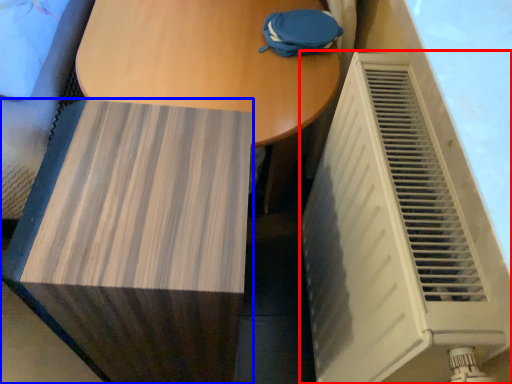
Question: Which object is further to the camera taking this photo, air conditioning (highlighted by a red box) or furniture (highlighted by a blue box)?

Choices:
 (A) air conditioning
 (B) furniture

Answer: (B)